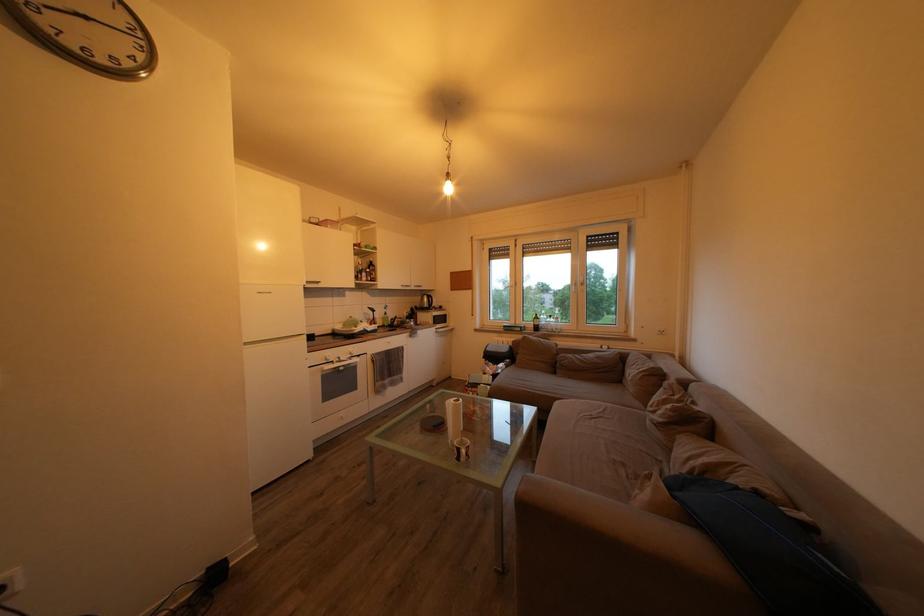
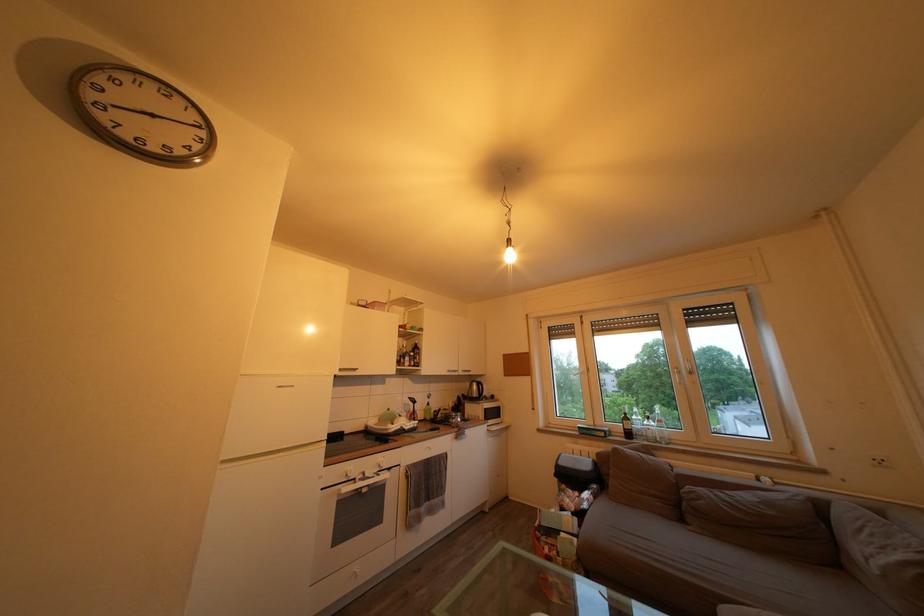
Where in the second image is the point corresponding to point (544, 323) from the first image?

(635, 424)